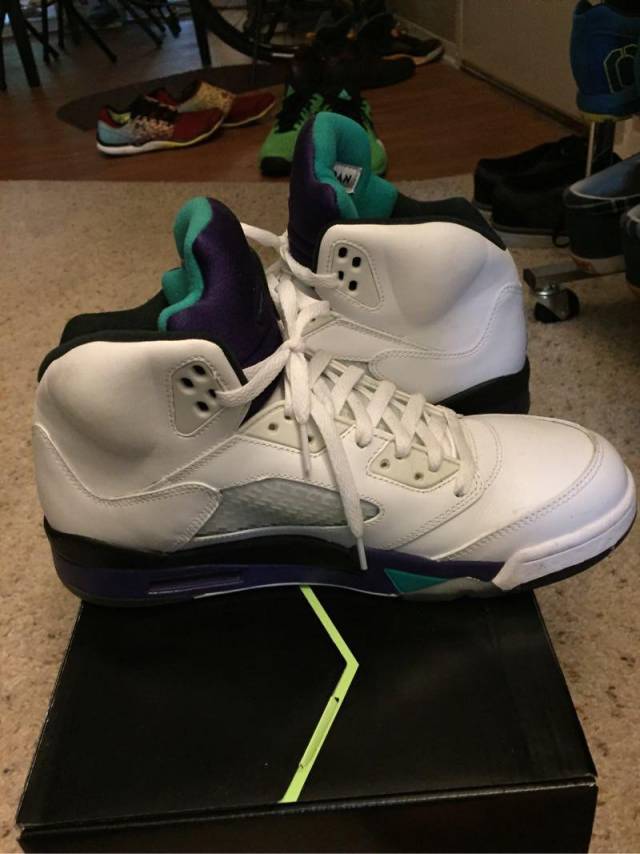
This screenshot has height=854, width=640. Identify the location of legs for chairs. (163, 20), (163, 646).